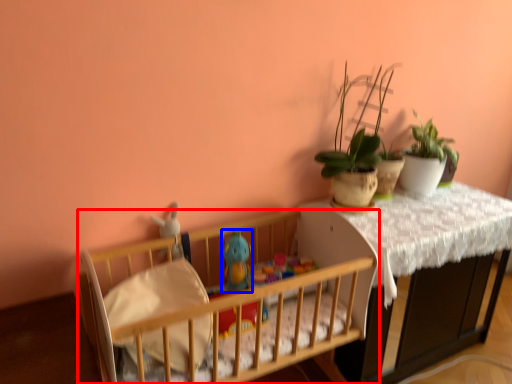
Question: Which of the following is the closest to the observer, infant bed (highlighted by a red box) or toy (highlighted by a blue box)?

Choices:
 (A) infant bed
 (B) toy

Answer: (A)